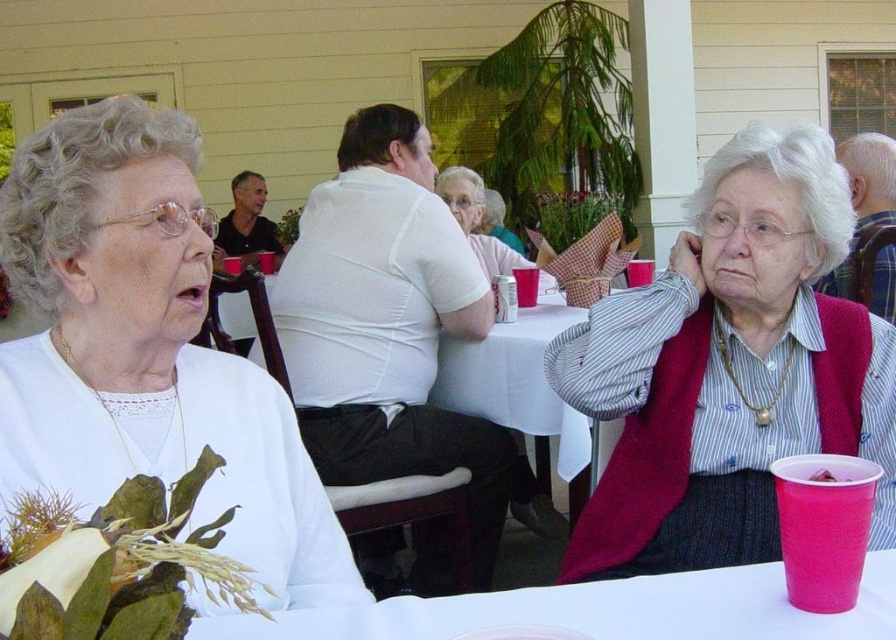
Question: Among these points, which one is nearest to the camera?

Choices:
 (A) (446, 604)
 (B) (142, 241)

Answer: (A)

Question: Considering the relative positions of striped fabric shirt at center and pink plastic cup at lower right in the image provided, where is striped fabric shirt at center located with respect to pink plastic cup at lower right?

Choices:
 (A) left
 (B) right

Answer: (B)

Question: Which object is farther from the camera taking this photo?

Choices:
 (A) white matte shirt at upper left
 (B) pink plastic cup at lower right
 (C) striped fabric shirt at center
 (D) white plastic table at lower center

Answer: (C)

Question: Is striped fabric shirt at center wider than pink plastic cup at lower right?

Choices:
 (A) yes
 (B) no

Answer: (A)

Question: Is white matte shirt at upper left above striped fabric shirt at center?

Choices:
 (A) yes
 (B) no

Answer: (A)

Question: Which object is positioned closest to the white plastic table at lower center?

Choices:
 (A) pink plastic cup at lower right
 (B) white matte shirt at upper left
 (C) striped fabric shirt at center

Answer: (A)